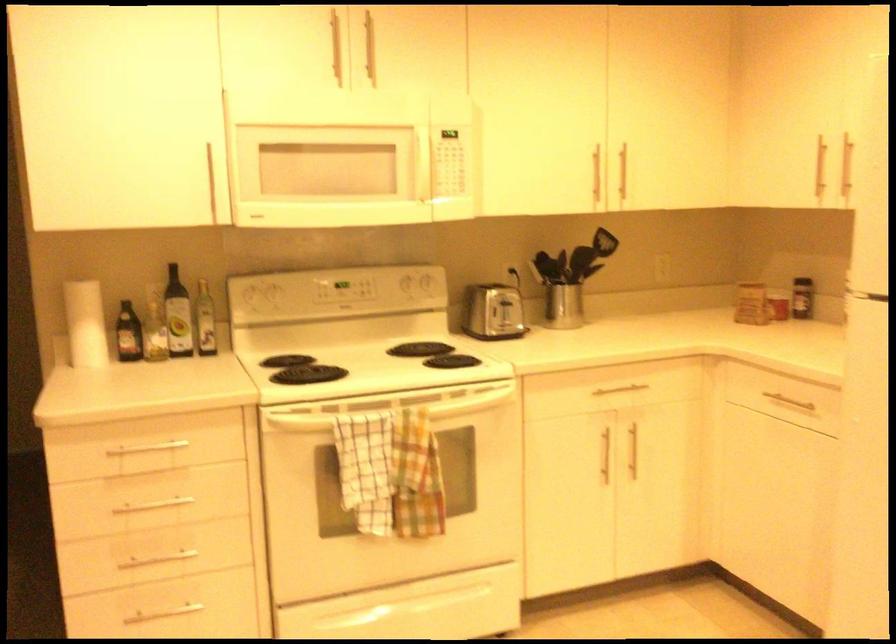
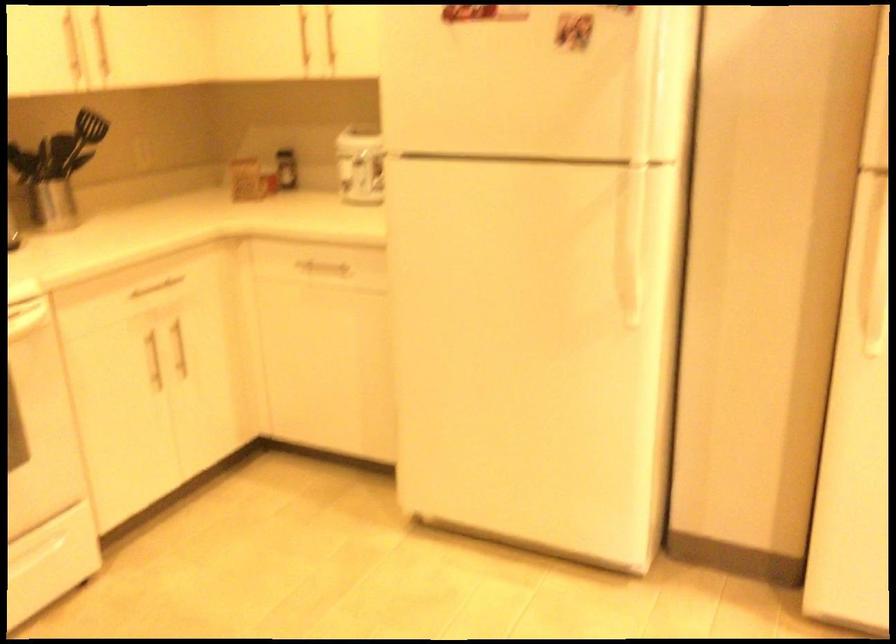
Locate, in the second image, the point that corresponds to point (631, 386) in the first image.

(159, 283)